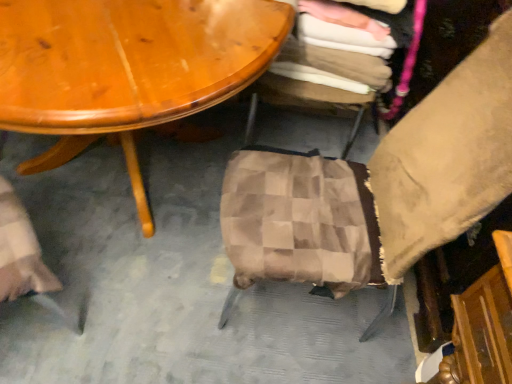
Question: Does checkered fabric stool at center, the 1th chair viewed from the back, appear on the right side of brown checkered fabric at center, arranged as the second chair when viewed from the back?

Choices:
 (A) no
 (B) yes

Answer: (B)

Question: Considering the relative sizes of checkered fabric stool at center, the second chair when ordered from front to back, and brown checkered fabric at center, acting as the first chair starting from the front, in the image provided, is checkered fabric stool at center, the second chair when ordered from front to back, bigger than brown checkered fabric at center, acting as the first chair starting from the front,?

Choices:
 (A) no
 (B) yes

Answer: (A)

Question: Is checkered fabric stool at center, the second chair when ordered from front to back, positioned with its back to brown checkered fabric at center, arranged as the second chair when viewed from the back?

Choices:
 (A) no
 (B) yes

Answer: (A)

Question: From the image's perspective, would you say checkered fabric stool at center, the 1th chair viewed from the back, is shown under brown checkered fabric at center, acting as the first chair starting from the front?

Choices:
 (A) no
 (B) yes

Answer: (A)

Question: Does checkered fabric stool at center, the second chair when ordered from front to back, have a smaller size compared to brown checkered fabric at center, arranged as the second chair when viewed from the back?

Choices:
 (A) yes
 (B) no

Answer: (A)

Question: Considering the relative positions of checkered fabric stool at center, the second chair when ordered from front to back, and brown checkered fabric at center, acting as the first chair starting from the front, in the image provided, is checkered fabric stool at center, the second chair when ordered from front to back, in front of brown checkered fabric at center, acting as the first chair starting from the front,?

Choices:
 (A) yes
 (B) no

Answer: (B)

Question: Is brown checkered fabric at center, acting as the first chair starting from the front, closer to the viewer compared to checkered fabric stool at center, the 1th chair viewed from the back?

Choices:
 (A) no
 (B) yes

Answer: (B)

Question: From a real-world perspective, is brown checkered fabric at center, arranged as the second chair when viewed from the back, on checkered fabric stool at center, the second chair when ordered from front to back?

Choices:
 (A) yes
 (B) no

Answer: (A)

Question: From the image's perspective, is brown checkered fabric at center, arranged as the second chair when viewed from the back, beneath checkered fabric stool at center, the 1th chair viewed from the back?

Choices:
 (A) no
 (B) yes

Answer: (B)

Question: Is brown checkered fabric at center, arranged as the second chair when viewed from the back, placed right next to checkered fabric stool at center, the 1th chair viewed from the back?

Choices:
 (A) no
 (B) yes

Answer: (A)

Question: Can you confirm if brown checkered fabric at center, arranged as the second chair when viewed from the back, is smaller than checkered fabric stool at center, the second chair when ordered from front to back?

Choices:
 (A) yes
 (B) no

Answer: (B)

Question: Is brown checkered fabric at center, arranged as the second chair when viewed from the back, looking in the opposite direction of checkered fabric stool at center, the second chair when ordered from front to back?

Choices:
 (A) no
 (B) yes

Answer: (A)

Question: From a real-world perspective, is checkered fabric stool at center, the 1th chair viewed from the back, above or below brown checkered fabric at center, acting as the first chair starting from the front?

Choices:
 (A) below
 (B) above

Answer: (A)